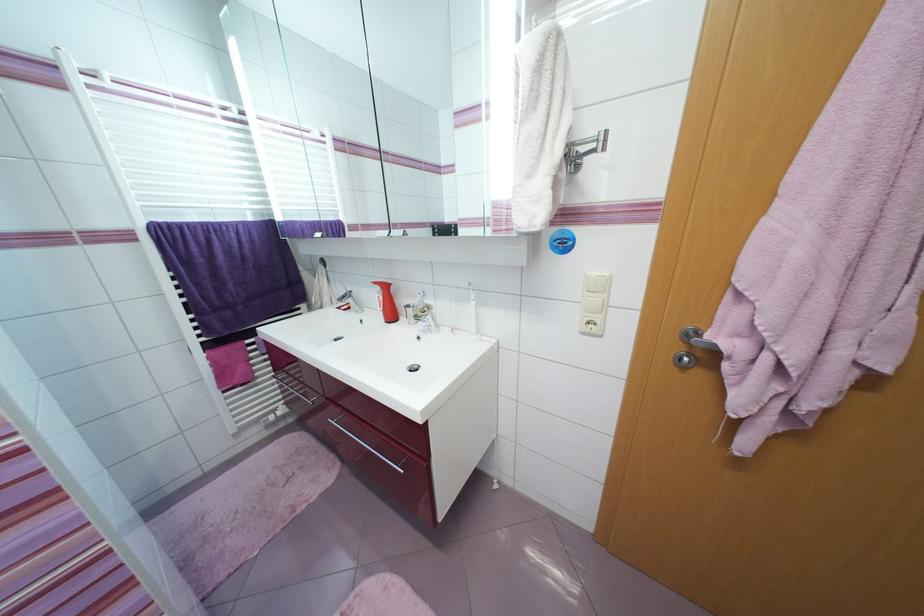
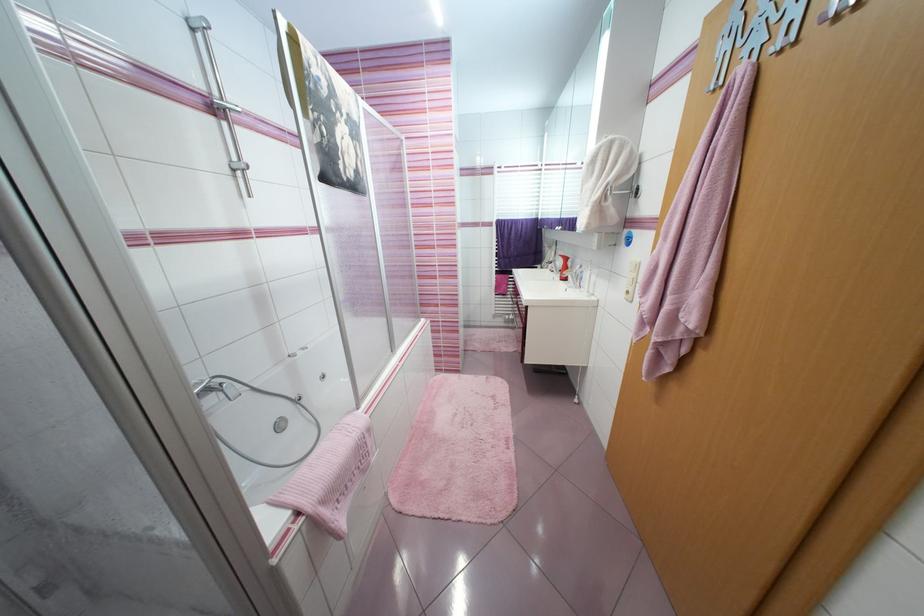
Locate, in the second image, the point that corresponds to point (359, 294) in the first image.

(563, 264)